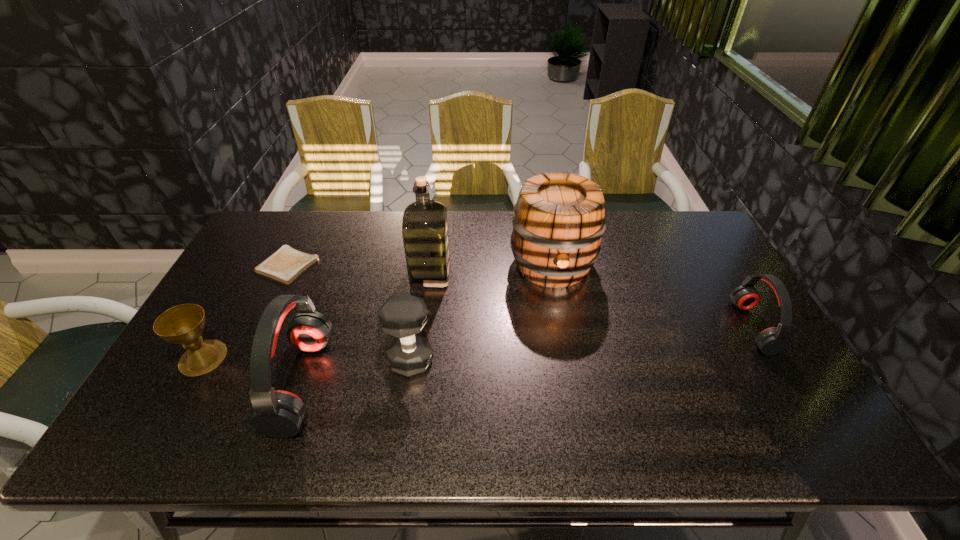
Where is `vacant region located 0.050m on the front of the shortest object`? This screenshot has height=540, width=960. vacant region located 0.050m on the front of the shortest object is located at coordinates (273, 296).

You are a GUI agent. You are given a task and a screenshot of the screen. Output one action in this format:
    pyautogui.click(x=<x>, y=<y>)
    Task: Click on the free space located on the side of the cider where the spigot is located
    The image size is (960, 540).
    Given the screenshot: What is the action you would take?
    pyautogui.click(x=564, y=326)

Locate an element on the screen. This screenshot has height=540, width=960. free space located 0.230m on the label of the tallest object is located at coordinates (522, 274).

Find the location of a particular element. This screenshot has height=540, width=960. vacant space located 0.310m on the back of the chalice is located at coordinates (255, 265).

Where is `free space located on the left of the dumbbell`? free space located on the left of the dumbbell is located at coordinates (262, 360).

Find the location of `toast located in the far edge section of the desktop`. toast located in the far edge section of the desktop is located at coordinates (286, 264).

The width and height of the screenshot is (960, 540). Identify the location of cider located at the far edge. (558, 220).

You are a GUI agent. You are given a task and a screenshot of the screen. Output one action in this format:
    pyautogui.click(x=<x>, y=<y>)
    Task: Click on the earphone that is at the near edge
    
    Given the screenshot: What is the action you would take?
    pyautogui.click(x=278, y=414)

What are the coordinates of `dumbbell that is at the near edge` in the screenshot? It's located at (403, 316).

Locate an element on the screen. toast located at the left edge is located at coordinates (286, 264).